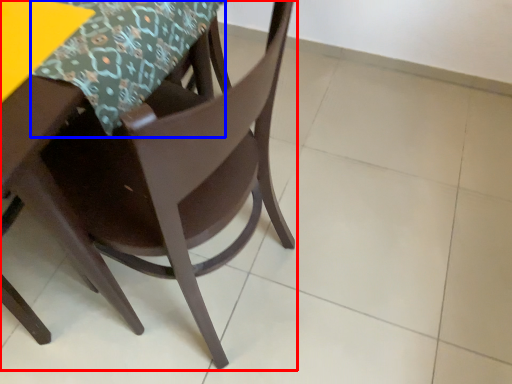
Question: Which object is further to the camera taking this photo, chair (highlighted by a red box) or tablecloth (highlighted by a blue box)?

Choices:
 (A) chair
 (B) tablecloth

Answer: (B)